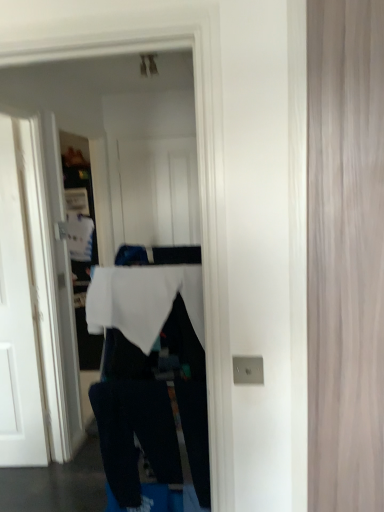
Question: Considering the relative positions of white fabric at center and white painted wood door at left in the image provided, is white fabric at center to the left or to the right of white painted wood door at left?

Choices:
 (A) right
 (B) left

Answer: (A)

Question: Considering the positions of white fabric at center and white painted wood door at left in the image, is white fabric at center wider or thinner than white painted wood door at left?

Choices:
 (A) wide
 (B) thin

Answer: (A)

Question: Based on their relative distances, which object is nearer to the white painted wood door at left?

Choices:
 (A) white matte tablecloth at center
 (B) dark blue cotton trousers at lower center
 (C) white fabric at center
 (D) wooden door at right

Answer: (B)

Question: Considering the real-world distances, which object is farthest from the dark blue cotton trousers at lower center?

Choices:
 (A) wooden door at right
 (B) white matte tablecloth at center
 (C) white fabric at center
 (D) white painted wood door at left

Answer: (D)